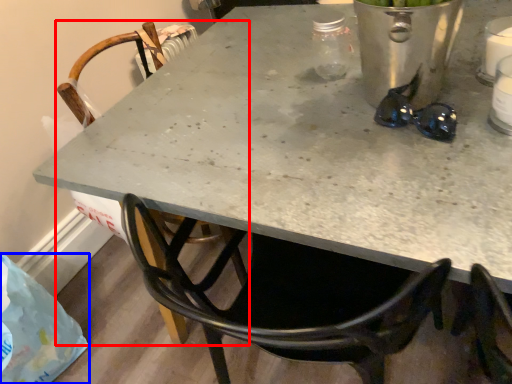
Question: Among these objects, which one is nearest to the camera, chair (highlighted by a red box) or plastic bag (highlighted by a blue box)?

Choices:
 (A) chair
 (B) plastic bag

Answer: (A)